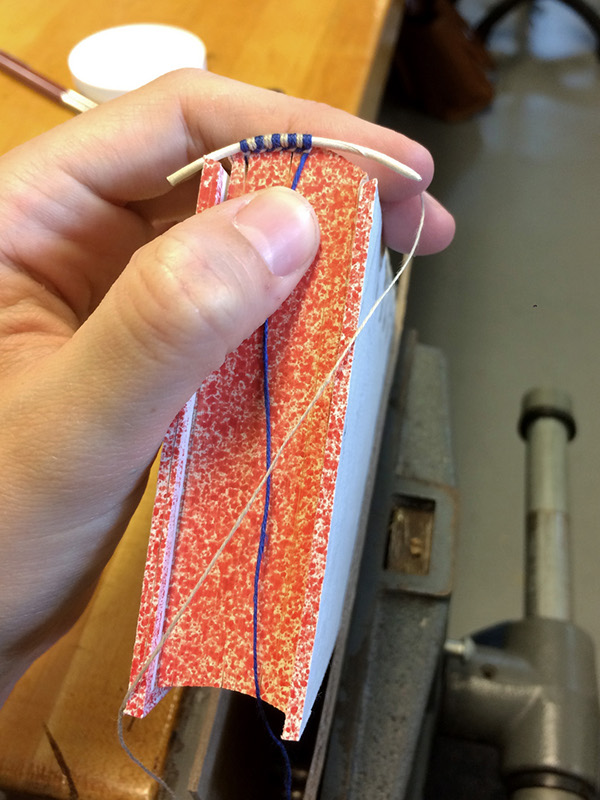
The width and height of the screenshot is (600, 800). Identify the location of book pages. (320, 441).